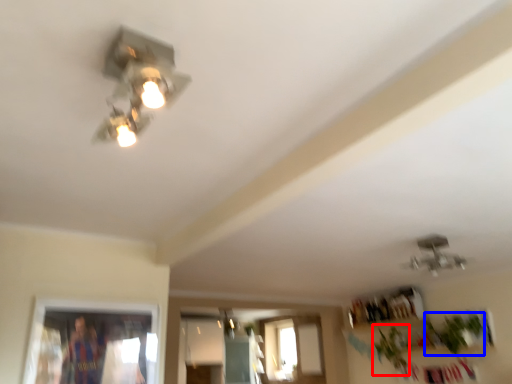
Question: Which point is closer to the camera, plant (highlighted by a red box) or plant (highlighted by a blue box)?

Choices:
 (A) plant
 (B) plant

Answer: (B)